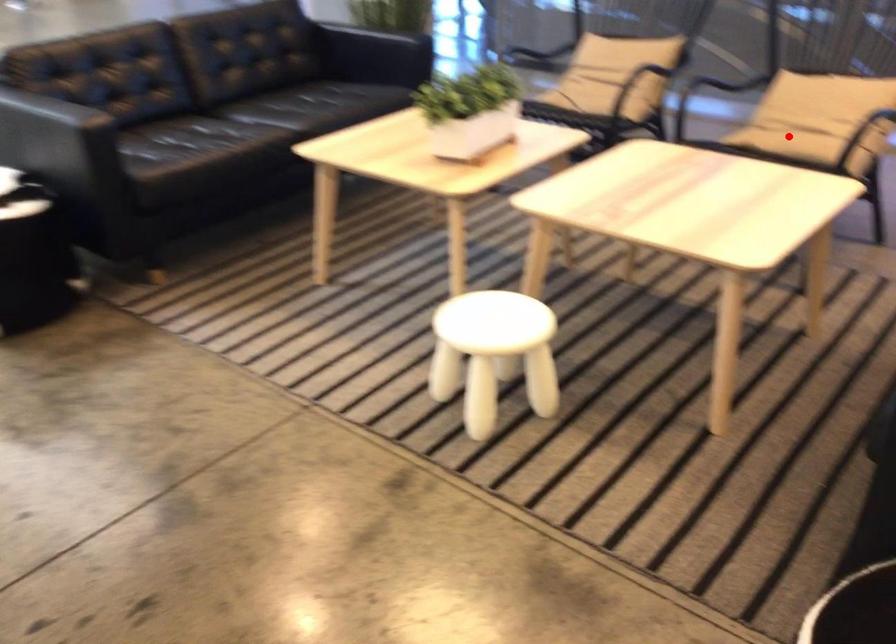
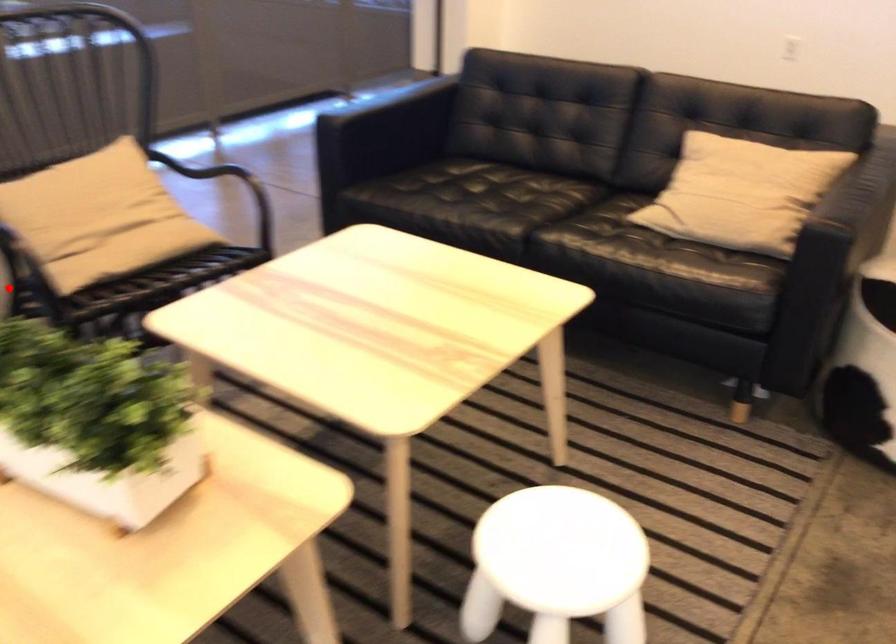
I am providing you with two images of the same scene from different viewpoints. A red point is marked on the first image and another point is marked on the second image. Does the point marked in image1 correspond to the same location as the one in image2?

No